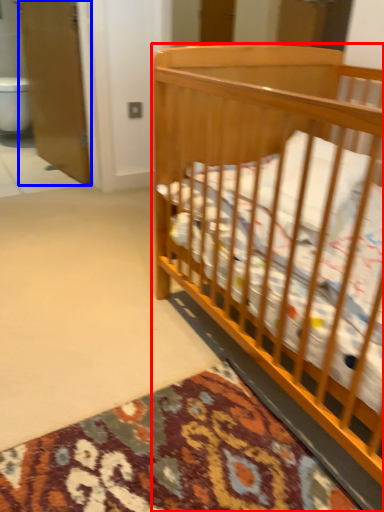
Question: Among these objects, which one is nearest to the camera, infant bed (highlighted by a red box) or screen door (highlighted by a blue box)?

Choices:
 (A) infant bed
 (B) screen door

Answer: (A)